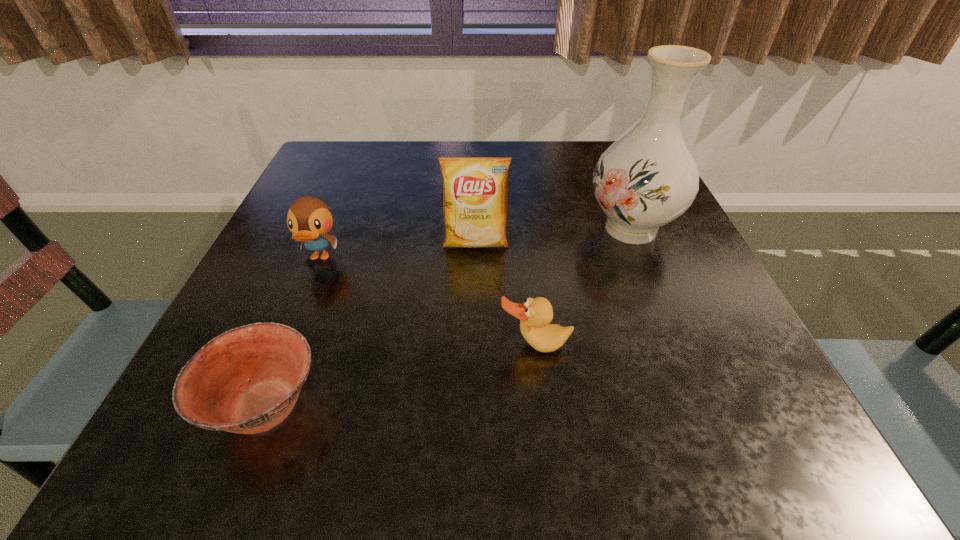
Locate an element on the screen. This screenshot has height=540, width=960. free space between the vase and the nearest object is located at coordinates (448, 317).

You are a GUI agent. You are given a task and a screenshot of the screen. Output one action in this format:
    pyautogui.click(x=<x>, y=<y>)
    Task: Click on the empty space that is in between the shorter duck and the taller duck
    This screenshot has width=960, height=540.
    Given the screenshot: What is the action you would take?
    pos(427,301)

The height and width of the screenshot is (540, 960). Find the location of `object that is the closest to the nearer duck`. object that is the closest to the nearer duck is located at coordinates (474, 189).

Locate which object ranks fourth in proximity to the bowl. Please provide its 2D coordinates. Your answer should be formatted as a tuple, i.e. [(x, y)], where the tuple contains the x and y coordinates of a point satisfying the conditions above.

[(646, 179)]

The height and width of the screenshot is (540, 960). I want to click on blank area in the image that satisfies the following two spatial constraints: 1. on the front-facing side of the nearest object; 2. on the right side of the left duck, so click(x=259, y=406).

In order to click on vacant space that satisfies the following two spatial constraints: 1. on the front-facing side of the left duck; 2. on the right side of the nearest object in this screenshot , I will do `click(259, 406)`.